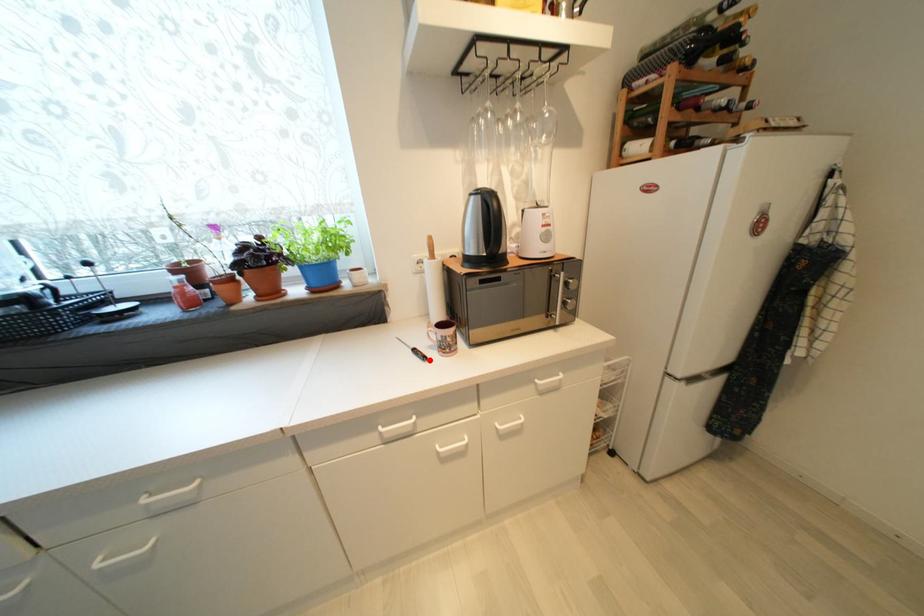
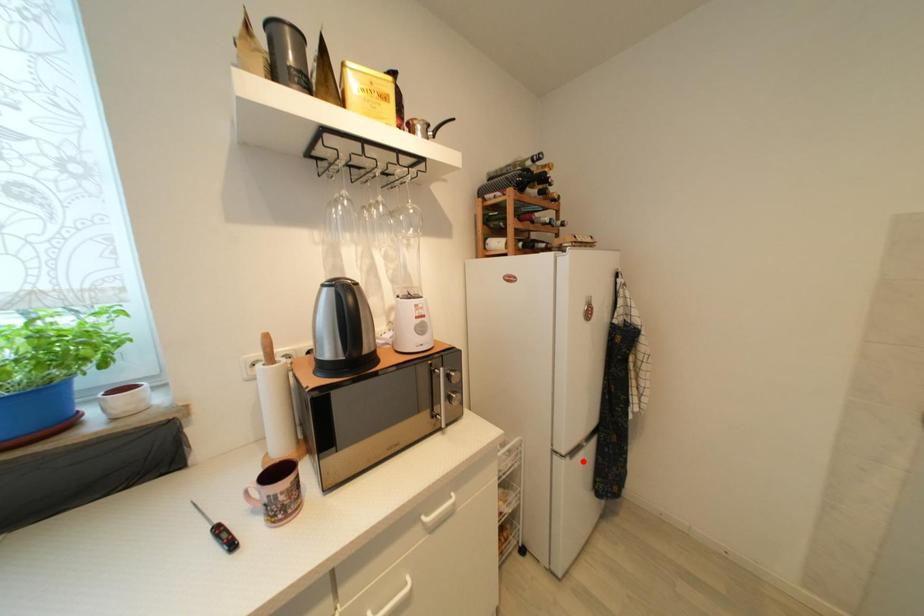
I am providing you with two images of the same scene from different viewpoints. A red point is marked on the first image and another point is marked on the second image. Does the point marked in image1 correspond to the same location as the one in image2?

No